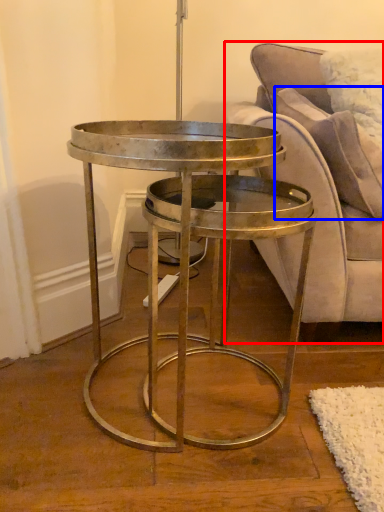
Question: Which object appears closest to the camera in this image, studio couch (highlighted by a red box) or pillow (highlighted by a blue box)?

Choices:
 (A) studio couch
 (B) pillow

Answer: (A)